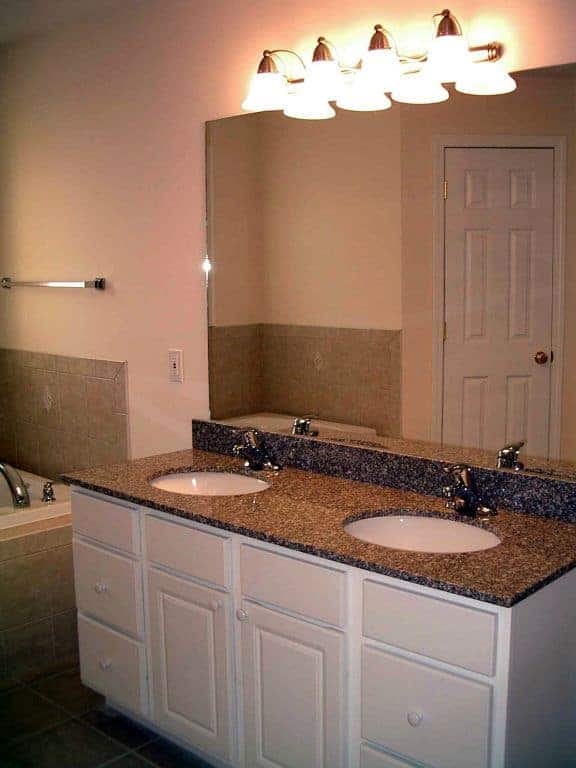
Where is `drawer`? The height and width of the screenshot is (768, 576). drawer is located at coordinates (113, 646).